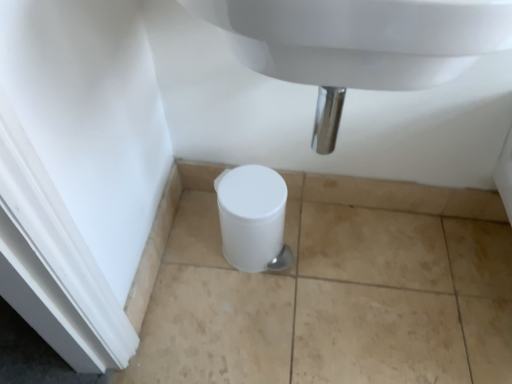
Question: Can you confirm if white plastic toilet at lower center is wider than white glossy sink at center?

Choices:
 (A) yes
 (B) no

Answer: (B)

Question: From the image's perspective, is white plastic toilet at lower center located above white glossy sink at center?

Choices:
 (A) yes
 (B) no

Answer: (B)

Question: Can you confirm if white plastic toilet at lower center is positioned to the right of white glossy sink at center?

Choices:
 (A) yes
 (B) no

Answer: (B)

Question: Considering the relative sizes of white plastic toilet at lower center and white glossy sink at center in the image provided, is white plastic toilet at lower center thinner than white glossy sink at center?

Choices:
 (A) no
 (B) yes

Answer: (B)

Question: Is white glossy sink at center completely or partially inside white plastic toilet at lower center?

Choices:
 (A) yes
 (B) no

Answer: (B)

Question: Is white plastic toilet at lower center smaller than white glossy sink at center?

Choices:
 (A) yes
 (B) no

Answer: (A)

Question: Is white glossy sink at center closer to camera compared to white plastic toilet at lower center?

Choices:
 (A) no
 (B) yes

Answer: (B)

Question: From the image's perspective, is white glossy sink at center under white plastic toilet at lower center?

Choices:
 (A) yes
 (B) no

Answer: (B)

Question: From a real-world perspective, is white glossy sink at center on white plastic toilet at lower center?

Choices:
 (A) yes
 (B) no

Answer: (A)

Question: Is white glossy sink at center further to camera compared to white plastic toilet at lower center?

Choices:
 (A) yes
 (B) no

Answer: (B)

Question: Can you see white glossy sink at center touching white plastic toilet at lower center?

Choices:
 (A) no
 (B) yes

Answer: (A)

Question: From a real-world perspective, is white glossy sink at center physically below white plastic toilet at lower center?

Choices:
 (A) no
 (B) yes

Answer: (A)

Question: Considering the positions of white plastic toilet at lower center and white glossy sink at center in the image, is white plastic toilet at lower center wider or thinner than white glossy sink at center?

Choices:
 (A) thin
 (B) wide

Answer: (A)